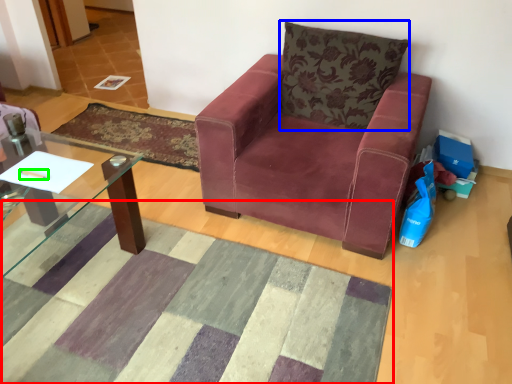
Question: Based on their relative distances, which object is nearer to mat (highlighted by a red box)? Choose from pillow (highlighted by a blue box) and pen (highlighted by a green box).

Choices:
 (A) pillow
 (B) pen

Answer: (B)